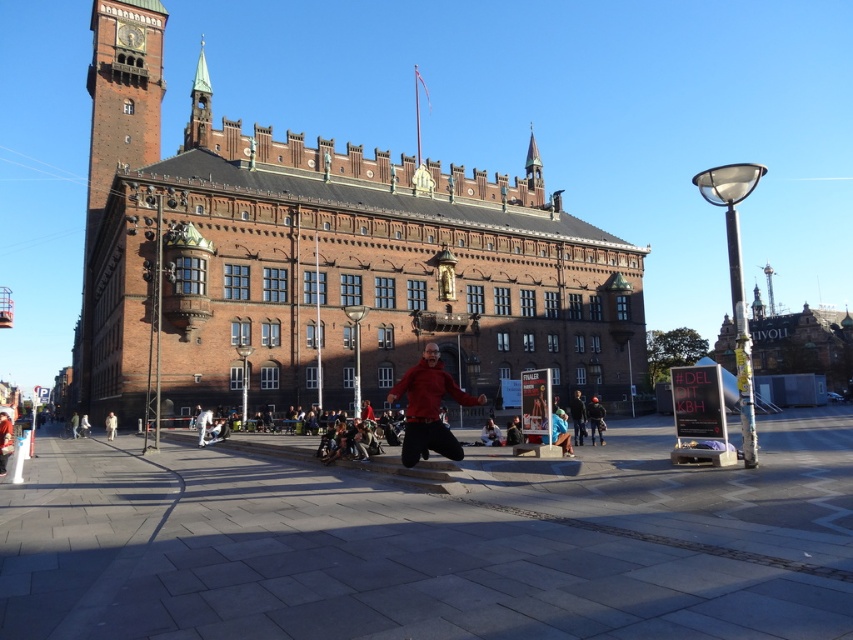
Based on the photo, you are a photographer standing in the square and want to capture both the brick tower at left and the dark blue jeans at lower right in a single frame. Which object will appear larger in your photo?

The brick tower at left is taller than the dark blue jeans at lower right, so it will appear larger in the photo.